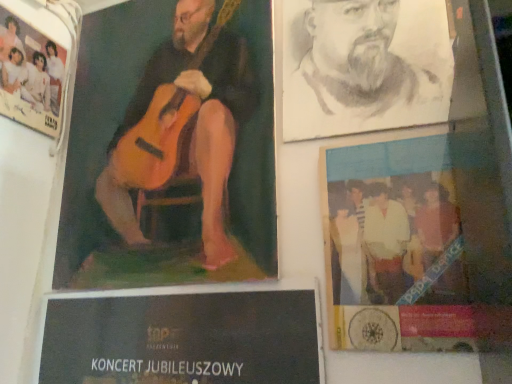
Question: Is wooden guitar at upper left, positioned as the second poster in left-to-right order, bigger or smaller than white paper poster at upper left, acting as the 3th poster starting from the right?

Choices:
 (A) small
 (B) big

Answer: (B)

Question: In the image, is wooden guitar at upper left, positioned as the second poster in left-to-right order, positioned in front of or behind white paper poster at upper left, arranged as the first poster when viewed from the left?

Choices:
 (A) behind
 (B) front

Answer: (B)

Question: Which is farther from the wooden guitar at upper left, positioned as the second poster in left-to-right order?

Choices:
 (A) blue glossy poster at lower right, which ranks as the 1th poster in right-to-left order
 (B) charcoal portrait of man at upper right
 (C) white paper poster at upper left, arranged as the first poster when viewed from the left

Answer: (A)

Question: Estimate the real-world distances between objects in this image. Which object is farther from the wooden guitar at upper left, positioned as the second poster in left-to-right order?

Choices:
 (A) charcoal portrait of man at upper right
 (B) blue glossy poster at lower right, which ranks as the 1th poster in right-to-left order
 (C) white paper poster at upper left, arranged as the first poster when viewed from the left

Answer: (B)